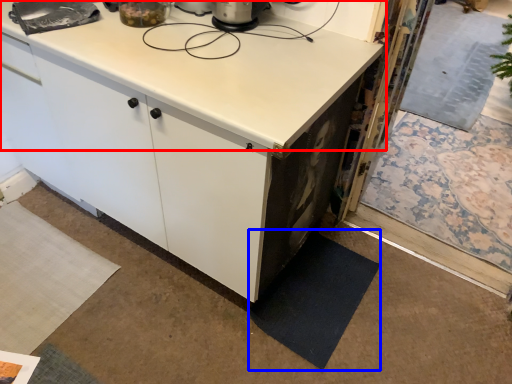
Question: Which object appears farthest to the camera in this image, countertop (highlighted by a red box) or mat (highlighted by a blue box)?

Choices:
 (A) countertop
 (B) mat

Answer: (B)